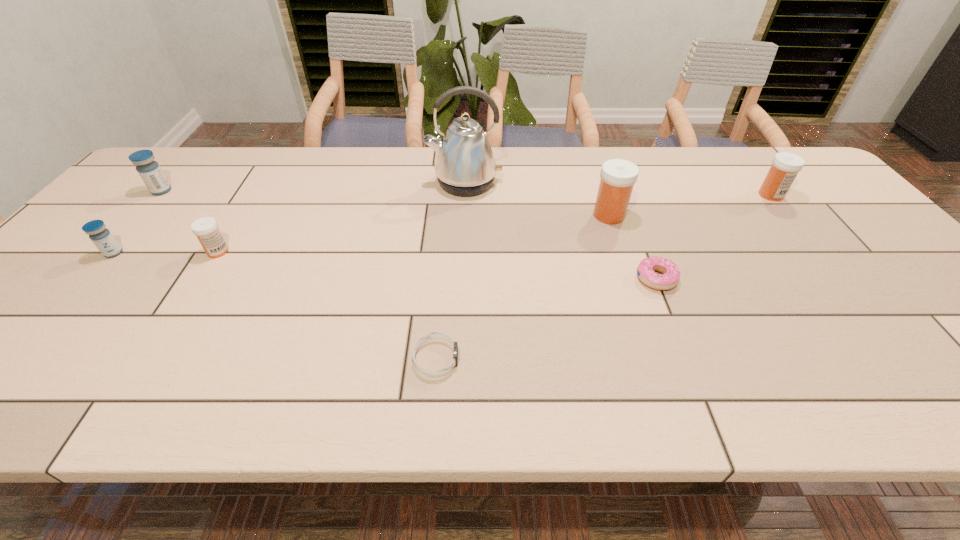
Find the location of `medicine that is the second nearest to the smallest white medicine`. medicine that is the second nearest to the smallest white medicine is located at coordinates (149, 170).

Locate an element on the screen. This screenshot has width=960, height=540. the second closest white medicine to the third medicine from left to right is located at coordinates (785, 166).

Where is `white medicine that is the third closest to the pink doughnut`? Image resolution: width=960 pixels, height=540 pixels. white medicine that is the third closest to the pink doughnut is located at coordinates (206, 229).

At what (x,y) coordinates should I click in order to perform the action: click on free space that satisfies the following two spatial constraints: 1. on the back side of the nearer blue medicine; 2. on the left side of the rightmost medicine. Please return your answer as a coordinate pair (x, y). Looking at the image, I should click on (165, 195).